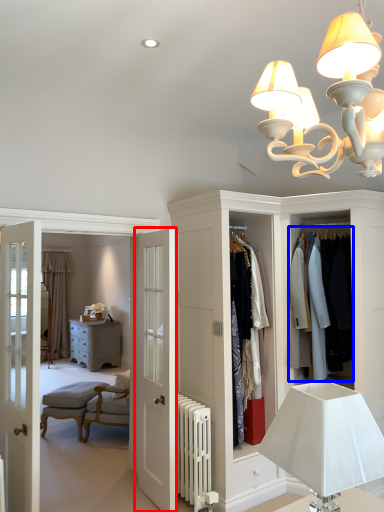
Question: Which of the following is the farthest to the observer, door (highlighted by a red box) or clothing (highlighted by a blue box)?

Choices:
 (A) door
 (B) clothing

Answer: (B)